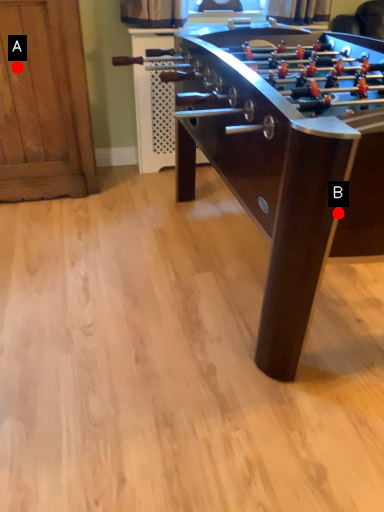
Question: Two points are circled on the image, labeled by A and B beside each circle. Which point is closer to the camera?

Choices:
 (A) A is closer
 (B) B is closer

Answer: (B)